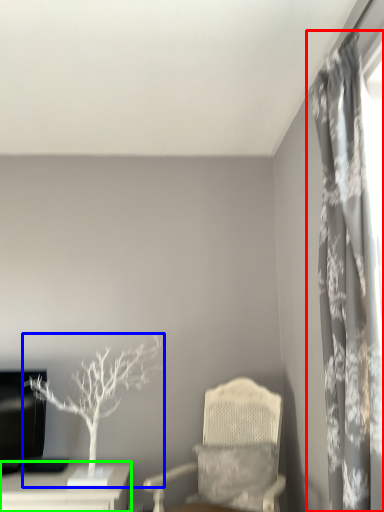
Question: Based on their relative distances, which object is farther from curtain (highlighted by a red box)? Choose from houseplant (highlighted by a blue box) and table (highlighted by a green box).

Choices:
 (A) houseplant
 (B) table

Answer: (B)